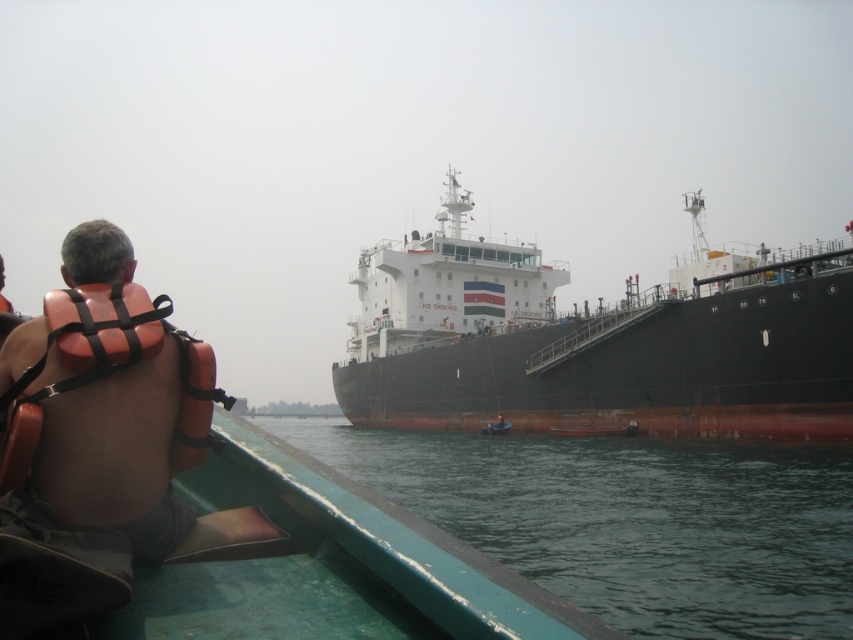
What do you see at coordinates (596, 340) in the screenshot? The width and height of the screenshot is (853, 640). I see `black matte ship at center` at bounding box center [596, 340].

Does point (584, 310) come farther from viewer compared to point (144, 477)?

Yes, it is behind point (144, 477).

Locate an element on the screen. The width and height of the screenshot is (853, 640). black matte ship at center is located at coordinates (596, 340).

Is black matte ship at center behind green water at lower left?

Yes.

This screenshot has height=640, width=853. What do you see at coordinates (596, 340) in the screenshot? I see `black matte ship at center` at bounding box center [596, 340].

Which is in front, point (360, 262) or point (833, 531)?

Point (833, 531) is in front.

What are the coordinates of `black matte ship at center` in the screenshot? It's located at (596, 340).

Describe the element at coordinates (630, 520) in the screenshot. I see `green water at lower left` at that location.

Which is behind, point (503, 504) or point (113, 429)?

The point (503, 504) is behind.

Between point (393, 449) and point (122, 307), which one is positioned in front?

Point (122, 307)

Locate an element on the screen. Image resolution: width=853 pixels, height=640 pixels. green water at lower left is located at coordinates (630, 520).